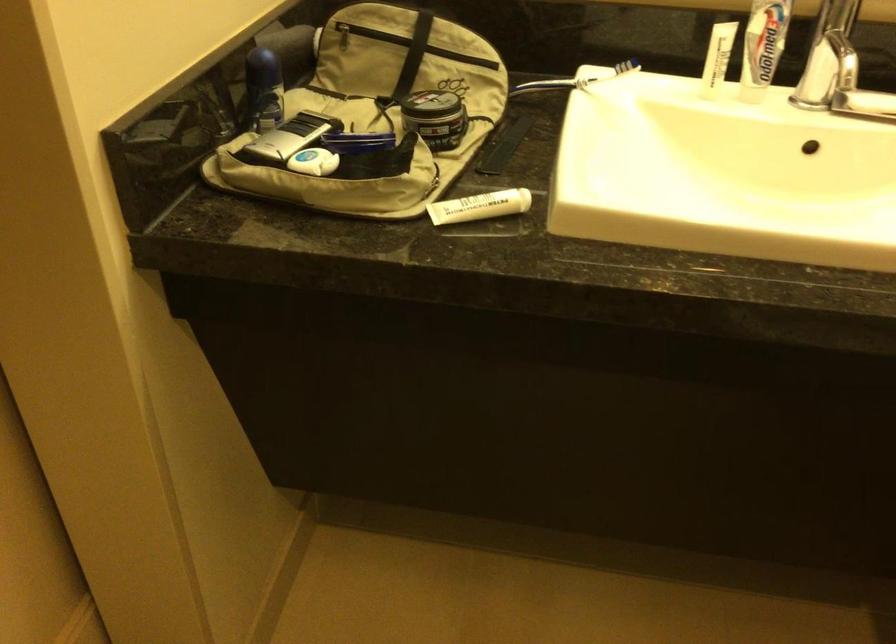
Where is `blue and white toothbrush`? This screenshot has width=896, height=644. blue and white toothbrush is located at coordinates (762, 46).